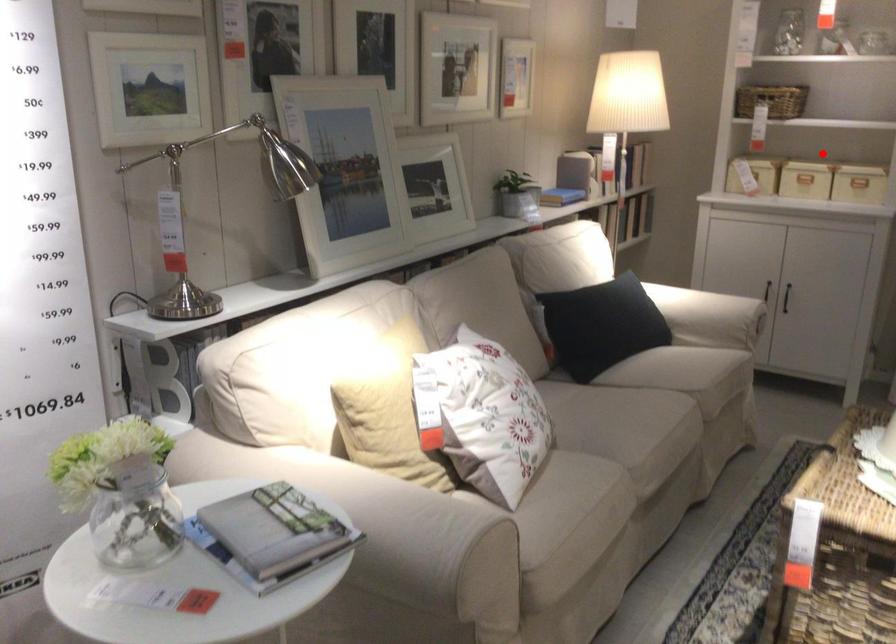
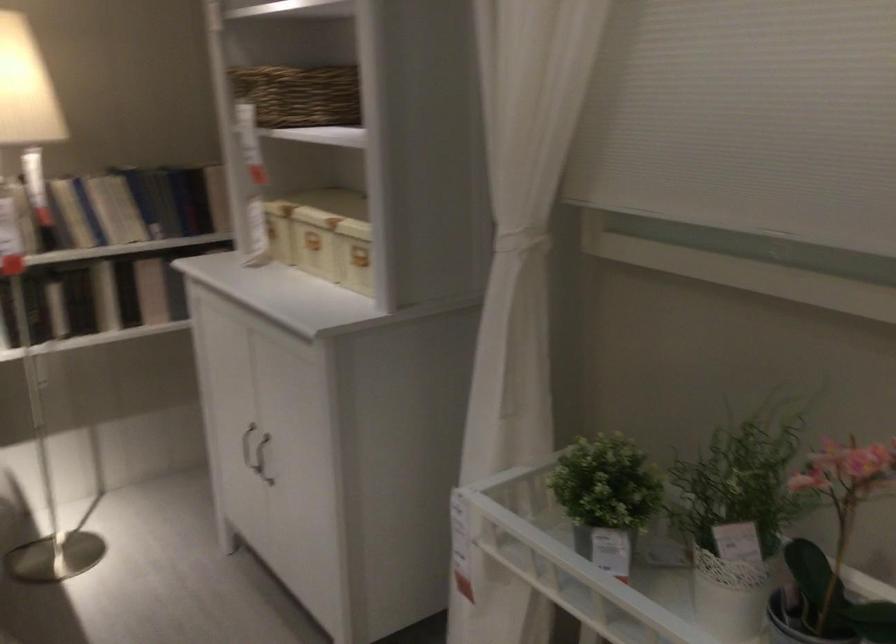
Question: I am providing you with two images of the same scene from different viewpoints. Image1 has a red point marked. In image2, the corresponding 3D location appears at what relative position? Reply with the corresponding letter.

Choices:
 (A) Closer
 (B) Farther

Answer: (A)